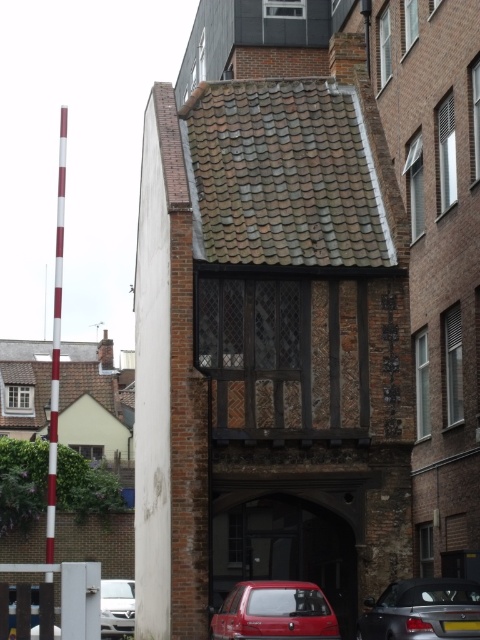
You are standing in front of the historic building and want to determine which of the two points, point 1 at coordinates point (x=389, y=620) or point 2 at coordinates point (x=307, y=605), is closer to you. Which point is closer?

Point (x=389, y=620) is closer to you because it is further to the viewer than point (x=307, y=605).

You are a delivery person needing to park your truck, which is 2.5 meters wide, in front of the building. The parking spot is between the metallic red car at center and the shiny black convertible at lower right. Can your truck fit in the space between them?

The metallic red car at center has a lesser width compared to shiny black convertible at lower right. Since the truck is 2.5 meters wide, and the space between the two cars must accommodate this width, the answer depends on the total available space between them. However, the description only states the relative widths of the cars, not the distance between them. Without knowing the exact distance between the cars, it is impossible to determine if the truck will fit.

You are a delivery driver who needs to park your van in front of the building. The van is 6 meters long. There is a metallic red car at center and a shiny black convertible at lower right parked nearby. Can you determine if there is enough space between them to park your van?

The metallic red car at center is smaller than the shiny black convertible at lower right. However, the description does not provide specific measurements of the distance between them. Without knowing the exact spacing between the metallic red car at center and the shiny black convertible at lower right, it is impossible to determine if there is sufficient space for a 6 meter long van.